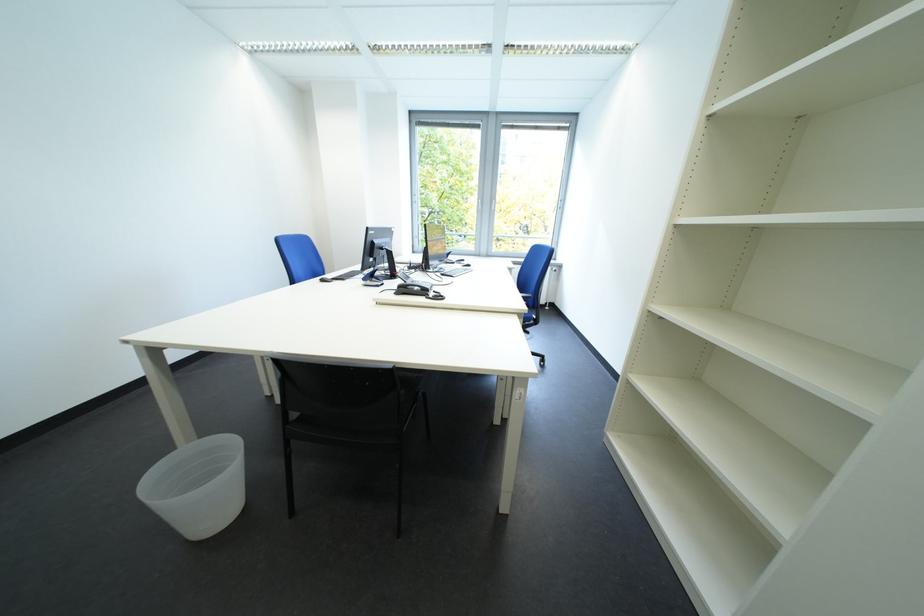
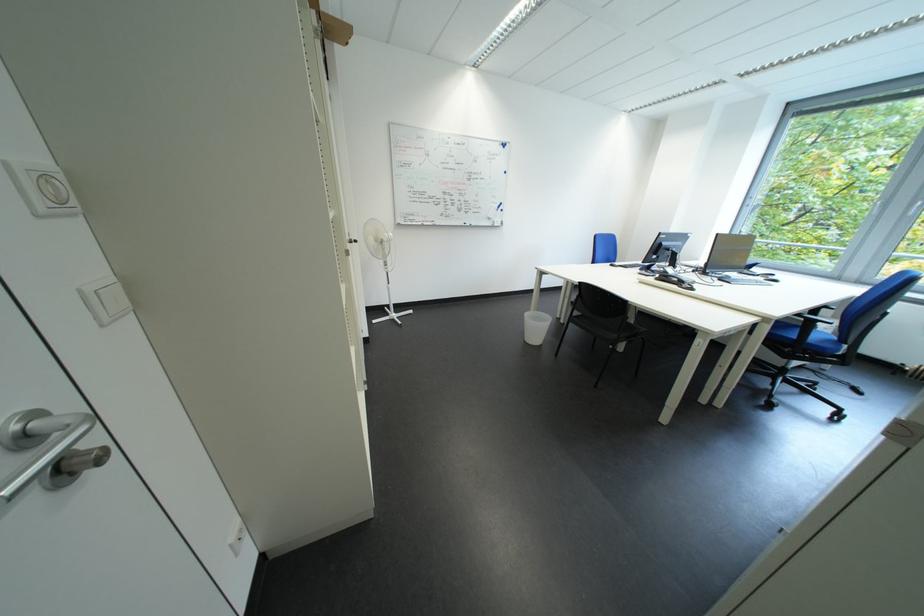
In the second image, find the point that corresponds to the point at 292,403 in the first image.

(575, 323)